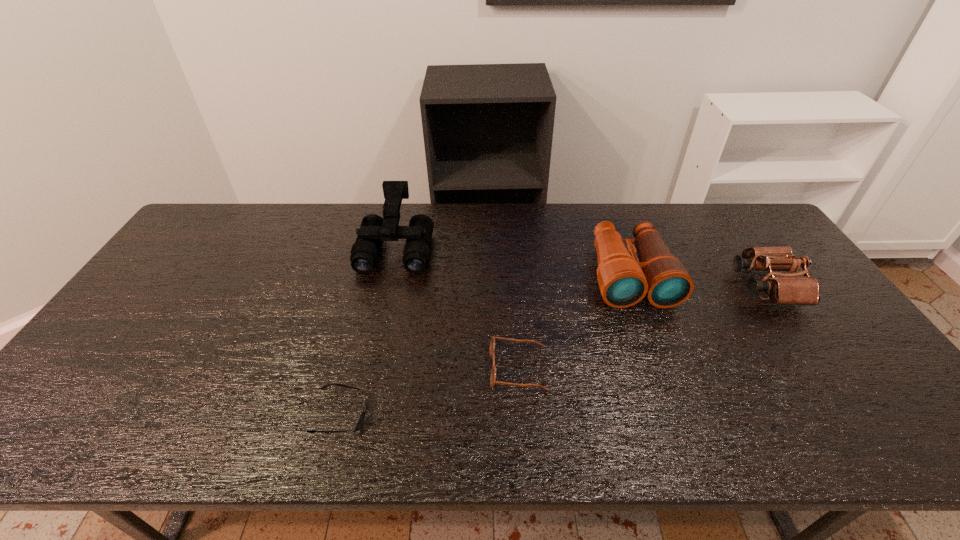
At what (x,y) coordinates should I click in order to perform the action: click on free space between the second shortest object and the sunglasses. Please return your answer as a coordinate pair (x, y). This screenshot has height=540, width=960. Looking at the image, I should click on (430, 392).

At what (x,y) coordinates should I click in order to perform the action: click on blank region between the third object from left to right and the second object from right to left. Please return your answer as a coordinate pair (x, y). The height and width of the screenshot is (540, 960). Looking at the image, I should click on [x=574, y=322].

Locate an element on the screen. The height and width of the screenshot is (540, 960). free space that is in between the second tallest binoculars and the rightmost object is located at coordinates (698, 280).

Locate an element on the screen. The image size is (960, 540). vacant area that lies between the tallest binoculars and the shortest object is located at coordinates (369, 331).

Locate an element on the screen. This screenshot has width=960, height=540. free spot between the shortest object and the spectacles is located at coordinates (430, 392).

Find the location of a particular element. This screenshot has width=960, height=540. object that is the fourth closest one to the sunglasses is located at coordinates (788, 290).

Find the location of a particular element. The width and height of the screenshot is (960, 540). object that is the second closest to the shortest object is located at coordinates (374, 229).

Identify the location of the third closest binoculars relative to the third object from right to left. The image size is (960, 540). (788, 290).

Where is `binoculars that is the closest to the third object from right to left`? This screenshot has width=960, height=540. binoculars that is the closest to the third object from right to left is located at coordinates (624, 281).

What are the coordinates of `free spot that satisfies the following two spatial constraints: 1. through the lenses of the second binoculars from left to right; 2. on the lenses of the shortest object` in the screenshot? It's located at (681, 415).